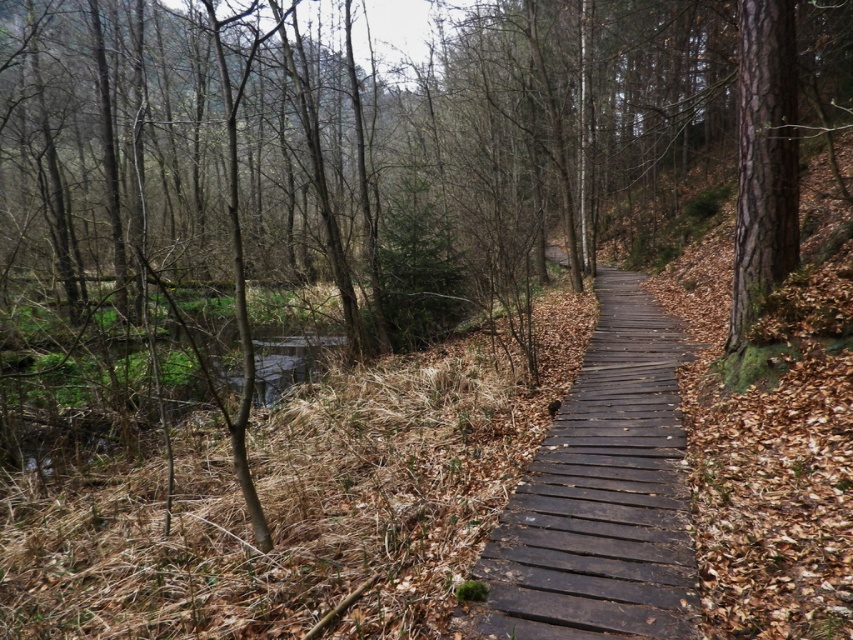
Can you confirm if dark brown wooden path at center is positioned below smooth bark tree at right?

Indeed, dark brown wooden path at center is positioned under smooth bark tree at right.

Is point (668, 554) positioned after point (788, 80)?

No, it is in front of (788, 80).

The width and height of the screenshot is (853, 640). Identify the location of dark brown wooden path at center. (602, 493).